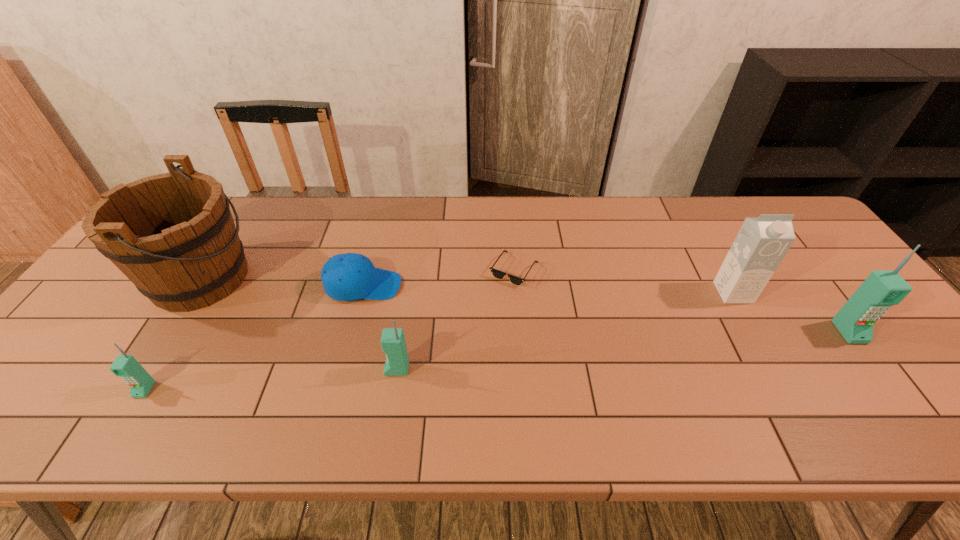
Find the location of a particular element. The width and height of the screenshot is (960, 540). the shortest cellular telephone is located at coordinates (127, 367).

Find the location of a particular element. The width and height of the screenshot is (960, 540). the nearest cellular telephone is located at coordinates (127, 367).

Locate an element on the screen. the fourth shortest object is located at coordinates (393, 343).

What are the coordinates of `the second cellular telephone from right to left` in the screenshot? It's located at (393, 343).

Locate an element on the screen. the farthest cellular telephone is located at coordinates (855, 320).

Find the location of `the rightmost cellular telephone`. the rightmost cellular telephone is located at coordinates (855, 320).

Where is `sunglasses`? The width and height of the screenshot is (960, 540). sunglasses is located at coordinates (498, 274).

Locate an element on the screen. The width and height of the screenshot is (960, 540). the fifth object from left to right is located at coordinates (498, 274).

Where is `carton`? carton is located at coordinates tap(762, 242).

Image resolution: width=960 pixels, height=540 pixels. I want to click on wine bucket, so click(172, 235).